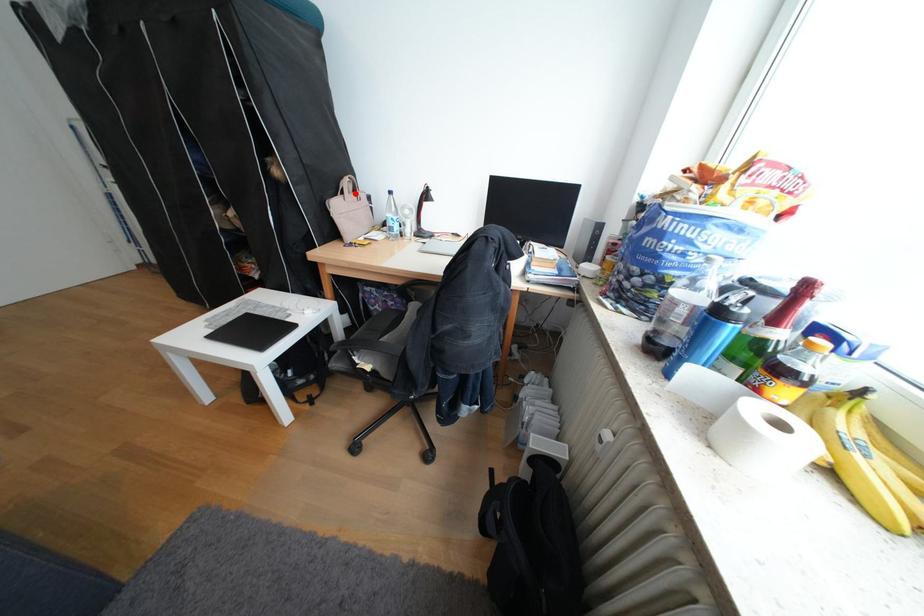
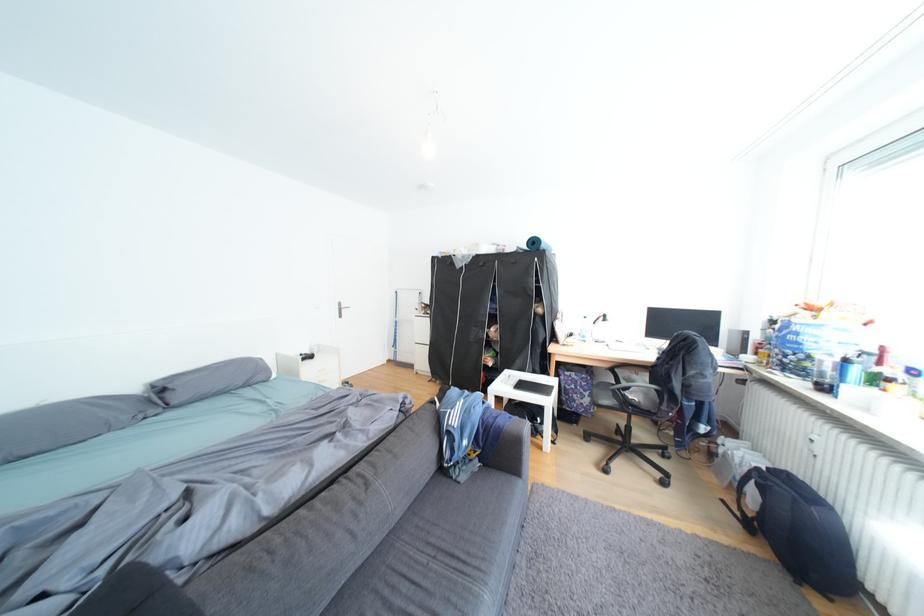
In the second image, find the point that corresponds to the highlighted location in the first image.

(570, 318)